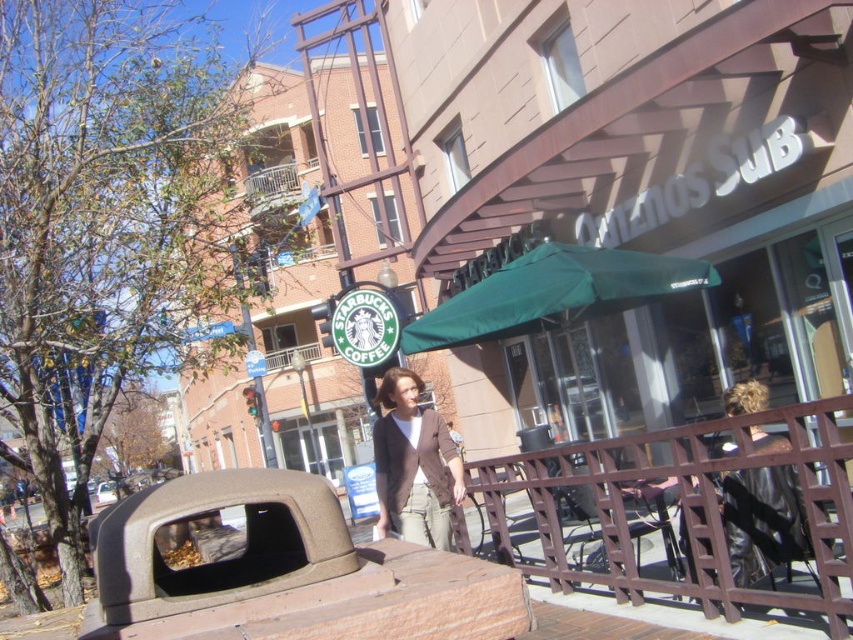
Who is more forward, [466,320] or [802,534]?

Positioned in front is point [802,534].

Is green fabric umbrella at center wider than shiny black jacket at upper right?

Yes, green fabric umbrella at center is wider than shiny black jacket at upper right.

This screenshot has height=640, width=853. In order to click on green fabric umbrella at center in this screenshot , I will do pyautogui.click(x=553, y=292).

I want to click on green fabric umbrella at center, so click(553, 292).

Is green fabric umbrella at center further to the viewer compared to khaki cotton pants at center?

Yes.

Between green fabric umbrella at center and khaki cotton pants at center, which one has more height?

Standing taller between the two is khaki cotton pants at center.

Is point (498, 312) more distant than point (416, 536)?

Yes, point (498, 312) is behind point (416, 536).

Identify the location of green fabric umbrella at center. (553, 292).

Who is more distant from viewer, (x=415, y=472) or (x=780, y=480)?

The point (x=415, y=472) is more distant.

Which is above, khaki cotton pants at center or shiny black jacket at upper right?

Positioned higher is shiny black jacket at upper right.

Where is `khaki cotton pants at center`? khaki cotton pants at center is located at coordinates (x=413, y=465).